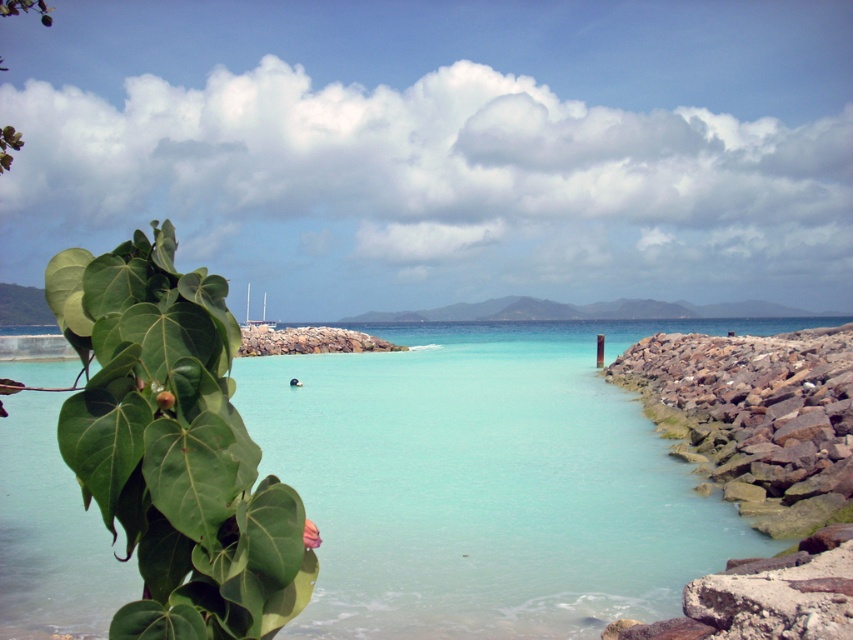
Question: Which point is closer to the camera?

Choices:
 (A) (762, 417)
 (B) (363, 465)

Answer: (B)

Question: Considering the relative positions of clear blue water at center and rockyrough stonerocky barrier at right in the image provided, where is clear blue water at center located with respect to rockyrough stonerocky barrier at right?

Choices:
 (A) left
 (B) right

Answer: (A)

Question: Observing the image, what is the correct spatial positioning of clear blue water at center in reference to rockyrough stonerocky barrier at right?

Choices:
 (A) above
 (B) below

Answer: (B)

Question: Among these points, which one is nearest to the camera?

Choices:
 (A) (318, 500)
 (B) (804, 385)

Answer: (A)

Question: Can you confirm if clear blue water at center is thinner than rockyrough stonerocky barrier at right?

Choices:
 (A) yes
 (B) no

Answer: (B)